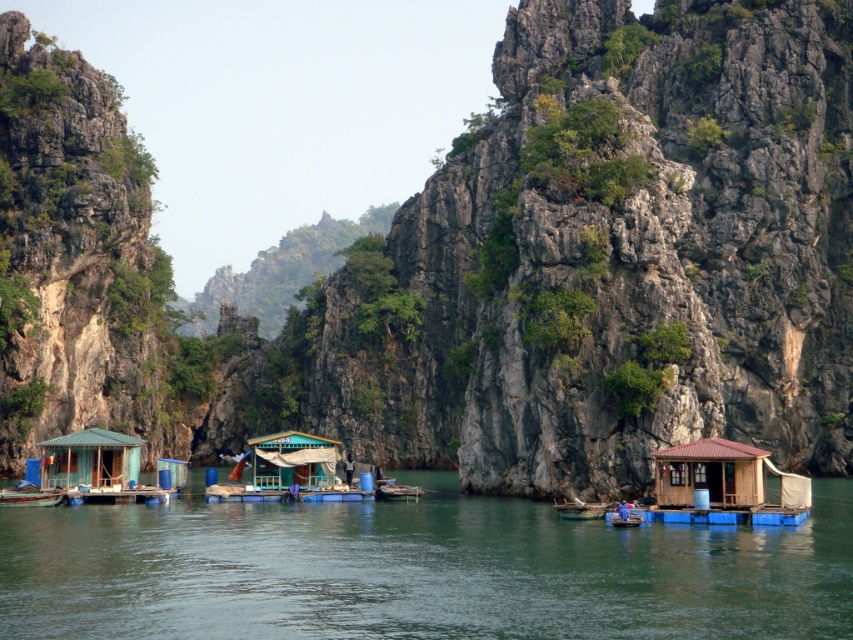
You are standing on the wooden platform of the wooden boat at center. You want to reach the wooden hut at center to deliver a package. How can you get there?

The wooden hut at center is located above the wooden boat at center, so you can climb up from the wooden boat at center to the wooden hut at center.

You are a visitor on a boat approaching the floating houses. You notice the green matte hut at lower left and the wooden hut at center. Which one appears taller from your perspective?

The wooden hut at center appears taller because it is taller than the green matte hut at lower left.